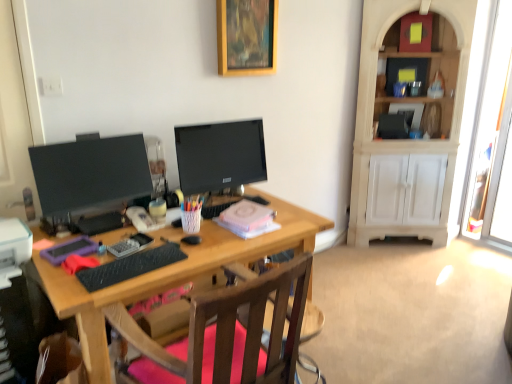
Question: Does black rubberized keyboard at center appear on the left side of purple matte case at left, which is the 3th stationery in right-to-left order?

Choices:
 (A) yes
 (B) no

Answer: (B)

Question: Can you confirm if black rubberized keyboard at center is bigger than purple matte case at left, placed as the 1th stationery when sorted from left to right?

Choices:
 (A) yes
 (B) no

Answer: (A)

Question: Is the depth of black rubberized keyboard at center greater than that of purple matte case at left, placed as the 1th stationery when sorted from left to right?

Choices:
 (A) yes
 (B) no

Answer: (B)

Question: Does black rubberized keyboard at center have a smaller size compared to purple matte case at left, placed as the 1th stationery when sorted from left to right?

Choices:
 (A) no
 (B) yes

Answer: (A)

Question: Is black rubberized keyboard at center thinner than purple matte case at left, placed as the 1th stationery when sorted from left to right?

Choices:
 (A) yes
 (B) no

Answer: (A)

Question: From a real-world perspective, is black rubberized keyboard at center positioned above or below black plastic computer tower at lower left?

Choices:
 (A) above
 (B) below

Answer: (A)

Question: From the image's perspective, is black rubberized keyboard at center above or below black plastic computer tower at lower left?

Choices:
 (A) above
 (B) below

Answer: (A)

Question: Would you say black rubberized keyboard at center is to the left or to the right of black plastic computer tower at lower left in the picture?

Choices:
 (A) right
 (B) left

Answer: (A)

Question: Would you say black rubberized keyboard at center is inside or outside black plastic computer tower at lower left?

Choices:
 (A) outside
 (B) inside

Answer: (A)

Question: Considering the positions of white woven pen holder at center, acting as the 1th stationery starting from the right, and black plastic computer tower at lower left in the image, is white woven pen holder at center, acting as the 1th stationery starting from the right, taller or shorter than black plastic computer tower at lower left?

Choices:
 (A) short
 (B) tall

Answer: (A)

Question: From a real-world perspective, is white woven pen holder at center, the third stationery in the left-to-right sequence, physically located above or below black plastic computer tower at lower left?

Choices:
 (A) above
 (B) below

Answer: (A)

Question: Does point tap(188, 225) appear closer or farther from the camera than point tap(1, 299)?

Choices:
 (A) farther
 (B) closer

Answer: (A)

Question: In the image, is white woven pen holder at center, the third stationery in the left-to-right sequence, on the left side or the right side of black plastic computer tower at lower left?

Choices:
 (A) right
 (B) left

Answer: (A)

Question: Considering the positions of clear plastic tray at center, the 2th stationery viewed from the left, and matte black monitor at left, the 1th television positioned from the left, in the image, is clear plastic tray at center, the 2th stationery viewed from the left, bigger or smaller than matte black monitor at left, the 1th television positioned from the left,?

Choices:
 (A) small
 (B) big

Answer: (A)

Question: Is point (114, 251) closer or farther from the camera than point (42, 215)?

Choices:
 (A) closer
 (B) farther

Answer: (A)